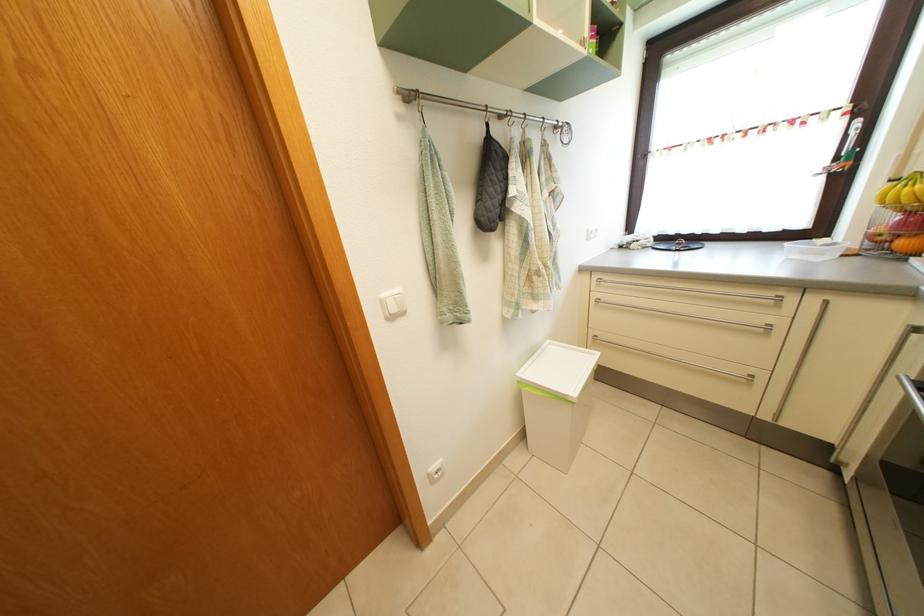
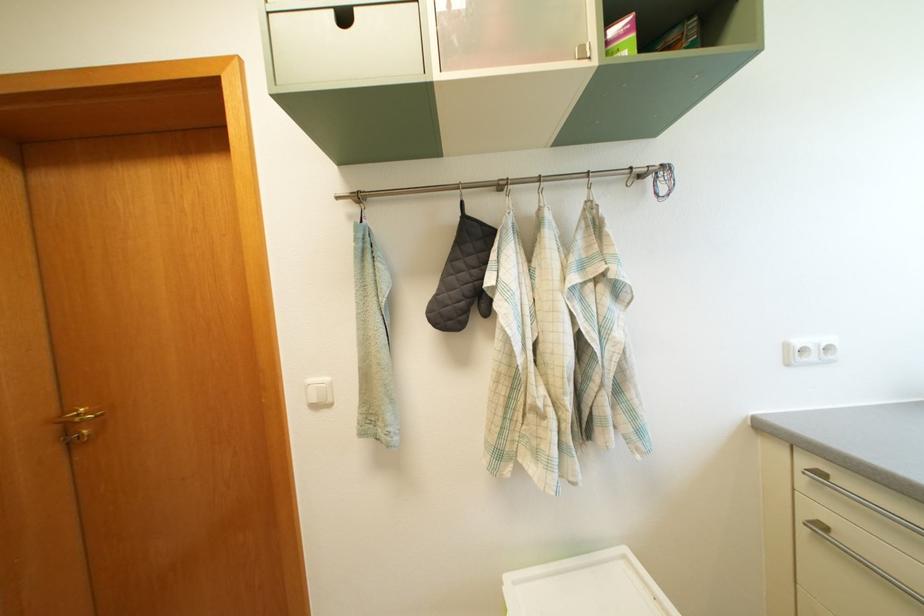
In the second image, find the point that corresponds to [392,302] in the first image.

(318, 387)